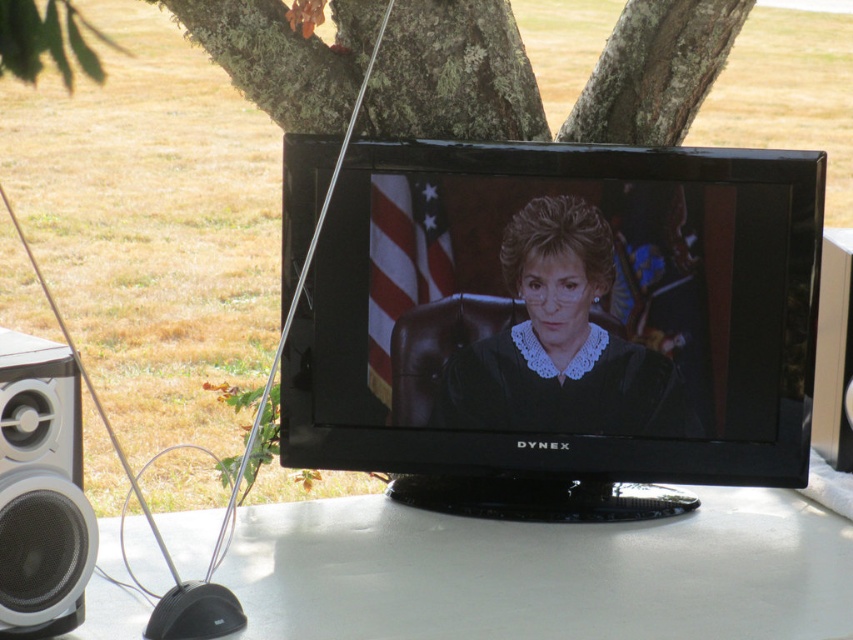
Question: Which point is closer to the camera?

Choices:
 (A) (682, 531)
 (B) (576, 310)

Answer: (B)

Question: Can you confirm if black glossy tv at center is positioned to the left of white glossy table at center?

Choices:
 (A) yes
 (B) no

Answer: (B)

Question: Is lichen-covered bark at center wider than black plastic speaker at lower left?

Choices:
 (A) yes
 (B) no

Answer: (A)

Question: Which of these objects is positioned closest to the white matte speaker at lower left?

Choices:
 (A) black plastic speaker at lower left
 (B) lichen-covered bark at center
 (C) matte black judge's robe at center

Answer: (C)

Question: Is lichen-covered bark at center smaller than black plastic speaker at lower left?

Choices:
 (A) no
 (B) yes

Answer: (A)

Question: Estimate the real-world distances between objects in this image. Which object is farther from the lichen-covered bark at center?

Choices:
 (A) white glossy table at center
 (B) black plastic speaker at lower left
 (C) matte black judge's robe at center

Answer: (A)